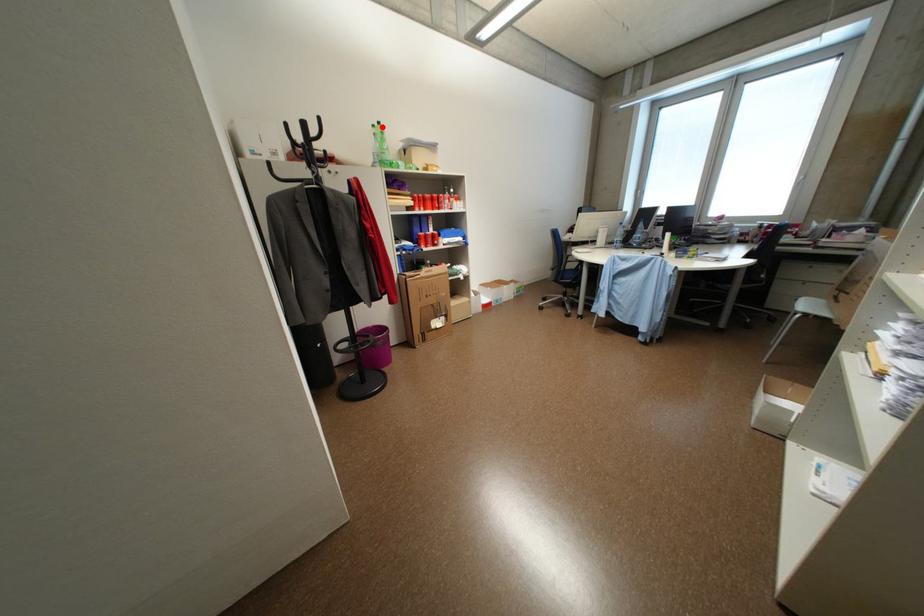
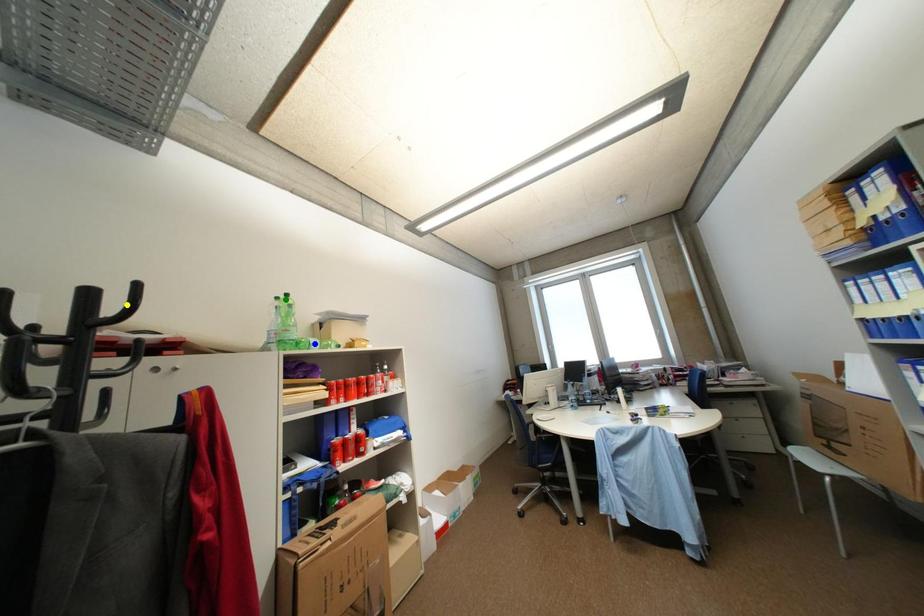
Question: I am providing you with two images of the same scene from different viewpoints. A red point is marked on the first image. You are given multiple points on the second image. Which point in image 2 represents the same 3d spot as the red point in image 1?

Choices:
 (A) green point
 (B) blue point
 (C) yellow point

Answer: (A)